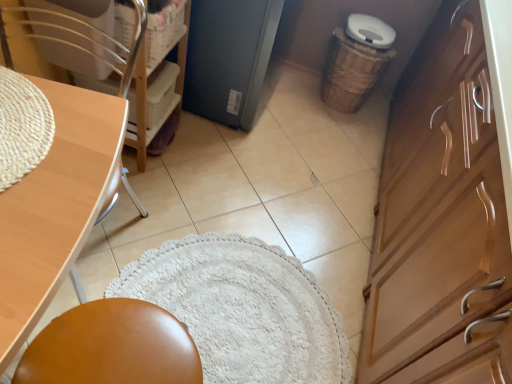
The image size is (512, 384). I want to click on woven plastic basket at upper left, the 2th basket viewed from the back, so [163, 32].

What do you see at coordinates (163, 32) in the screenshot?
I see `woven plastic basket at upper left, which is the second basket in right-to-left order` at bounding box center [163, 32].

This screenshot has width=512, height=384. What do you see at coordinates (351, 72) in the screenshot?
I see `woven brown basket at right, the 1th basket when ordered from right to left` at bounding box center [351, 72].

The image size is (512, 384). In order to click on matte black refrigerator at center in this screenshot , I will do `click(229, 58)`.

What are the coordinates of `woven plastic basket at upper left, the 2th basket viewed from the back` in the screenshot? It's located at (163, 32).

What's the angular difference between woven plastic basket at upper left, the 1th basket positioned from the left, and wooden chair at left's facing directions?

The facing directions of woven plastic basket at upper left, the 1th basket positioned from the left, and wooden chair at left are 91.3 degrees apart.

Choose the correct answer: Is woven plastic basket at upper left, the 2th basket viewed from the back, inside wooden chair at left or outside it?

woven plastic basket at upper left, the 2th basket viewed from the back, cannot be found inside wooden chair at left.

Is woven plastic basket at upper left, the 2th basket viewed from the back, oriented towards wooden chair at left?

No.

From a real-world perspective, is woven plastic basket at upper left, the 1th basket positioned from the left, positioned above or below wooden chair at left?

From a real-world perspective, woven plastic basket at upper left, the 1th basket positioned from the left, is physically above wooden chair at left.

Considering the relative sizes of light brown wood desk at left and woven plastic basket at upper left, which is the second basket in right-to-left order, in the image provided, is light brown wood desk at left smaller than woven plastic basket at upper left, which is the second basket in right-to-left order,?

Incorrect, light brown wood desk at left is not smaller in size than woven plastic basket at upper left, which is the second basket in right-to-left order.

Measure the distance from light brown wood desk at left to woven plastic basket at upper left, which is the second basket in right-to-left order.

The distance of light brown wood desk at left from woven plastic basket at upper left, which is the second basket in right-to-left order, is 25.39 inches.

Is light brown wood desk at left wider than woven plastic basket at upper left, the 1th basket positioned from the left?

Yes, light brown wood desk at left is wider than woven plastic basket at upper left, the 1th basket positioned from the left.

Is light brown wood desk at left turned away from woven plastic basket at upper left, the 1th basket positioned from the left?

light brown wood desk at left is not turned away from woven plastic basket at upper left, the 1th basket positioned from the left.

Looking at their sizes, would you say woven brown basket at right, which is counted as the 2th basket, starting from the front, is wider or thinner than light brown wood desk at left?

Clearly, woven brown basket at right, which is counted as the 2th basket, starting from the front, has less width compared to light brown wood desk at left.

Could you tell me if woven brown basket at right, which is counted as the 2th basket, starting from the front, is turned towards light brown wood desk at left?

Yes.

Is woven brown basket at right, which is counted as the 2th basket, starting from the front, not close to light brown wood desk at left?

woven brown basket at right, which is counted as the 2th basket, starting from the front, is positioned a significant distance from light brown wood desk at left.

From the image's perspective, which one is positioned lower, woven brown basket at right, arranged as the first basket when viewed from the back, or light brown wood desk at left?

light brown wood desk at left.

Is woven plastic basket at upper left, the 2th basket viewed from the back, further to camera compared to matte black refrigerator at center?

That is False.

Identify the location of basket above the matte black refrigerator at center (from a real-world perspective). (163, 32).

Is woven plastic basket at upper left, which is the second basket in right-to-left order, located outside matte black refrigerator at center?

That's correct, woven plastic basket at upper left, which is the second basket in right-to-left order, is outside of matte black refrigerator at center.

From a real-world perspective, is woven plastic basket at upper left, which ranks as the 1th basket in front-to-back order, physically located above or below matte black refrigerator at center?

woven plastic basket at upper left, which ranks as the 1th basket in front-to-back order, is situated higher than matte black refrigerator at center in the real world.

Looking at this image, does light brown wood desk at left have a lesser height compared to wooden chair at left?

Yes, light brown wood desk at left is shorter than wooden chair at left.

Identify the location of chair behind the light brown wood desk at left. (94, 40).

Does light brown wood desk at left come in front of wooden chair at left?

Yes, light brown wood desk at left is closer to the viewer.

Is light brown wood desk at left positioned with its back to wooden chair at left?

light brown wood desk at left does not have its back to wooden chair at left.

Which is farther, [127,84] or [20,201]?

Point [127,84]

Is wooden chair at left positioned far away from light brown wood desk at left?

→ They are positioned close to each other.

Considering the relative positions of wooden chair at left and light brown wood desk at left in the image provided, is wooden chair at left to the right of light brown wood desk at left from the viewer's perspective?

Yes, wooden chair at left is to the right of light brown wood desk at left.

Can you confirm if wooden chair at left is shorter than light brown wood desk at left?

No.

Who is taller, wooden cabinet at right or woven brown basket at right, marked as the second basket in a left-to-right arrangement?

wooden cabinet at right is taller.

Who is smaller, wooden cabinet at right or woven brown basket at right, the 1th basket when ordered from right to left?

woven brown basket at right, the 1th basket when ordered from right to left.

From the image's perspective, which one is positioned lower, wooden cabinet at right or woven brown basket at right, which is counted as the 2th basket, starting from the front?

From the image's view, wooden cabinet at right is below.

The height and width of the screenshot is (384, 512). What are the coordinates of `chair below the woven plastic basket at upper left, which ranks as the 1th basket in front-to-back order (from the image's perspective)` in the screenshot? It's located at (94, 40).

Which basket is the 1st one when counting from the right side of the light brown wood desk at left? Please provide its 2D coordinates.

[(163, 32)]

Considering their positions, is matte black refrigerator at center positioned closer to wooden chair at left than woven plastic basket at upper left, the 1th basket positioned from the left?

woven plastic basket at upper left, the 1th basket positioned from the left, is closer to wooden chair at left.

Which object lies further to the anchor point light brown wood desk at left, wooden chair at left or matte black refrigerator at center?

Among the two, matte black refrigerator at center is located further to light brown wood desk at left.

When comparing their distances from woven plastic basket at upper left, which is the second basket in right-to-left order, does wooden chair at left or wooden cabinet at right seem closer?

Among the two, wooden chair at left is located nearer to woven plastic basket at upper left, which is the second basket in right-to-left order.

From the image, which object appears to be farther from woven brown basket at right, the 1th basket when ordered from right to left, woven plastic basket at upper left, which is the second basket in right-to-left order, or wooden cabinet at right?

woven plastic basket at upper left, which is the second basket in right-to-left order, is further to woven brown basket at right, the 1th basket when ordered from right to left.

Looking at the image, which one is located closer to matte black refrigerator at center, wooden chair at left or wooden cabinet at right?

Based on the image, wooden chair at left appears to be nearer to matte black refrigerator at center.

Considering their positions, is woven brown basket at right, marked as the second basket in a left-to-right arrangement, positioned further to light brown wood desk at left than wooden cabinet at right?

The object further to light brown wood desk at left is woven brown basket at right, marked as the second basket in a left-to-right arrangement.

Estimate the real-world distances between objects in this image. Which object is closer to woven brown basket at right, arranged as the first basket when viewed from the back, light brown wood desk at left or matte black refrigerator at center?

matte black refrigerator at center.

Looking at the image, which one is located closer to matte black refrigerator at center, wooden chair at left or light brown wood desk at left?

wooden chair at left is closer to matte black refrigerator at center.

The height and width of the screenshot is (384, 512). What are the coordinates of `chair between light brown wood desk at left and wooden cabinet at right from left to right` in the screenshot? It's located at (94, 40).

At what (x,y) coordinates should I click in order to perform the action: click on basket located between light brown wood desk at left and woven brown basket at right, marked as the second basket in a left-to-right arrangement, in the depth direction. Please return your answer as a coordinate pair (x, y). Looking at the image, I should click on (163, 32).

The image size is (512, 384). Identify the location of screen door between wooden cabinet at right and woven brown basket at right, the 1th basket when ordered from right to left, from front to back. (229, 58).

Locate an element on the screen. Image resolution: width=512 pixels, height=384 pixels. chair between light brown wood desk at left and matte black refrigerator at center along the z-axis is located at coordinates (94, 40).